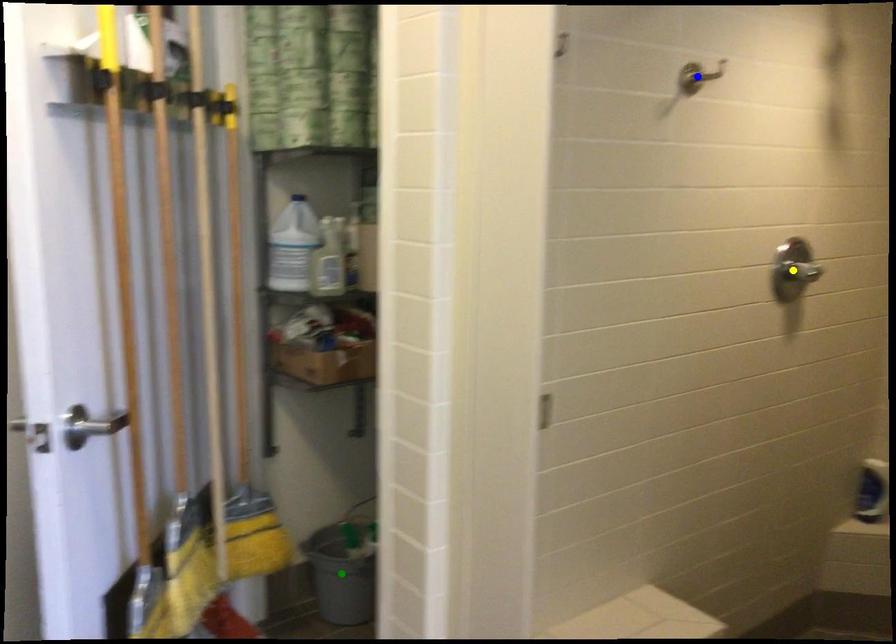
Order these from nearest to farthest:
1. yellow point
2. green point
3. blue point

green point, yellow point, blue point